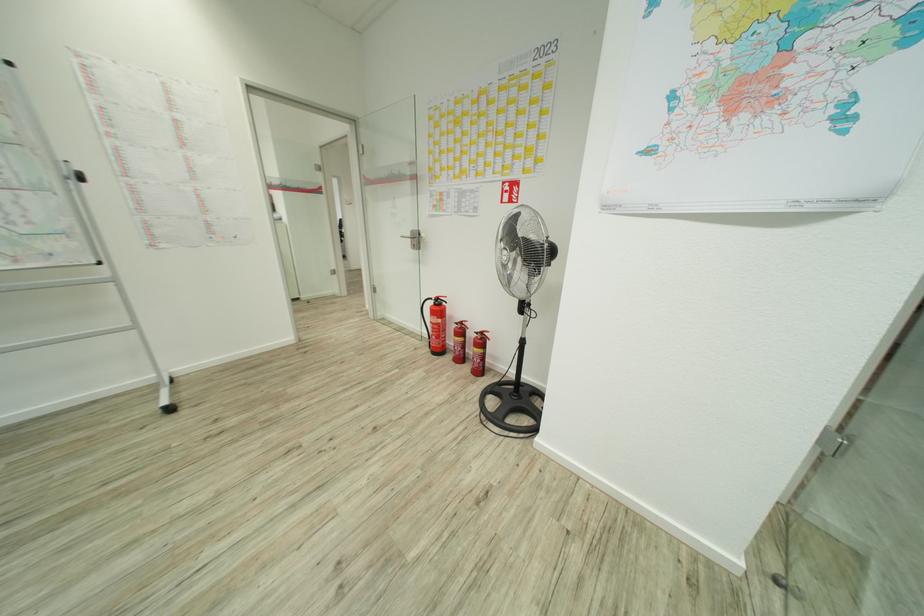
This screenshot has height=616, width=924. Find the location of `whiteboard locking knob`. whiteboard locking knob is located at coordinates 79,176.